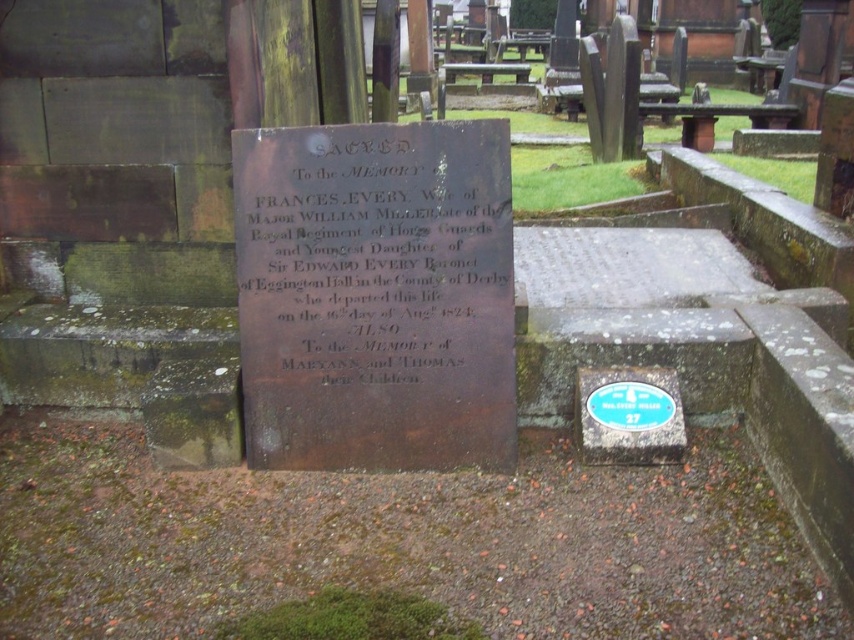
Measure the distance between bronze plaque at center and camera.

bronze plaque at center and camera are 2.77 meters apart from each other.

Image resolution: width=854 pixels, height=640 pixels. Describe the element at coordinates (375, 296) in the screenshot. I see `bronze plaque at center` at that location.

The width and height of the screenshot is (854, 640). I want to click on bronze plaque at center, so click(375, 296).